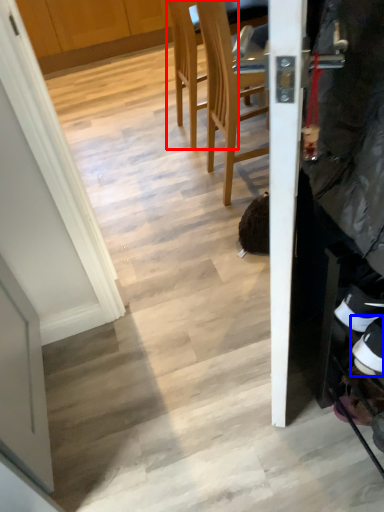
Question: Which object appears farthest to the camera in this image, chair (highlighted by a red box) or footwear (highlighted by a blue box)?

Choices:
 (A) chair
 (B) footwear

Answer: (A)